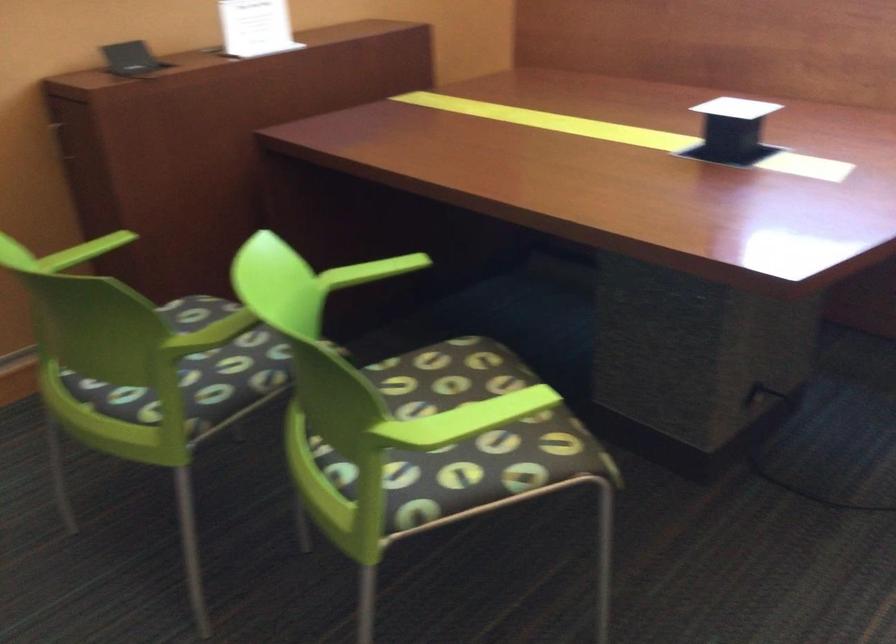
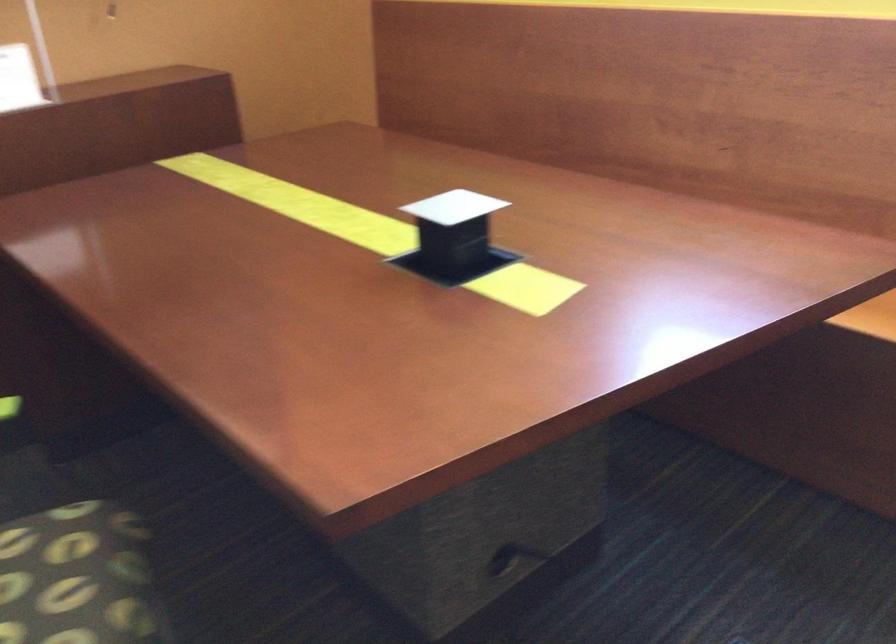
Question: How did the camera likely rotate?

Choices:
 (A) Left
 (B) Right
 (C) Up
 (D) Down

Answer: (C)